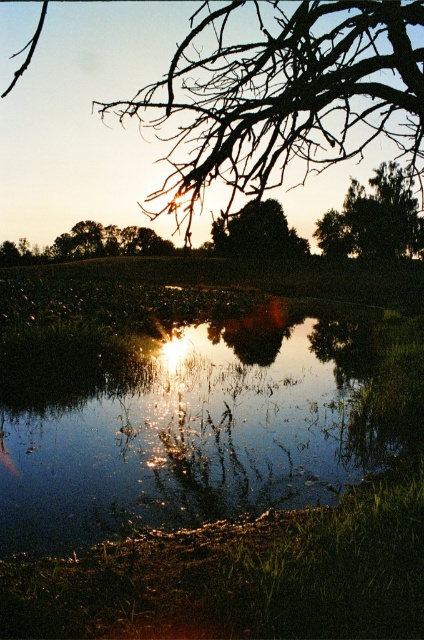
You are standing at the edge of the water and want to locate the exact center point of the reflective glass water at center. According to the coordinates provided, where should you look?

The reflective glass water at center is located at coordinates point (183,419).

In the scene shown: You are standing in the serene natural scene and want to take a photo of both the green matte tree at upper right and the green matte tree at center. Which tree should you position closer to the right side of your camera frame to include both in the photo?

You should position the green matte tree at upper right closer to the right side of your camera frame since it is already on the right side of the green matte tree at center.

You are an artist trying to paint this scene. You want to ensure the reflective glass water at center and the green matte tree at center are proportionally accurate. Which object should you make wider in your painting?

The reflective glass water at center should be made wider in the painting because it is wider than the green matte tree at center according to the description.